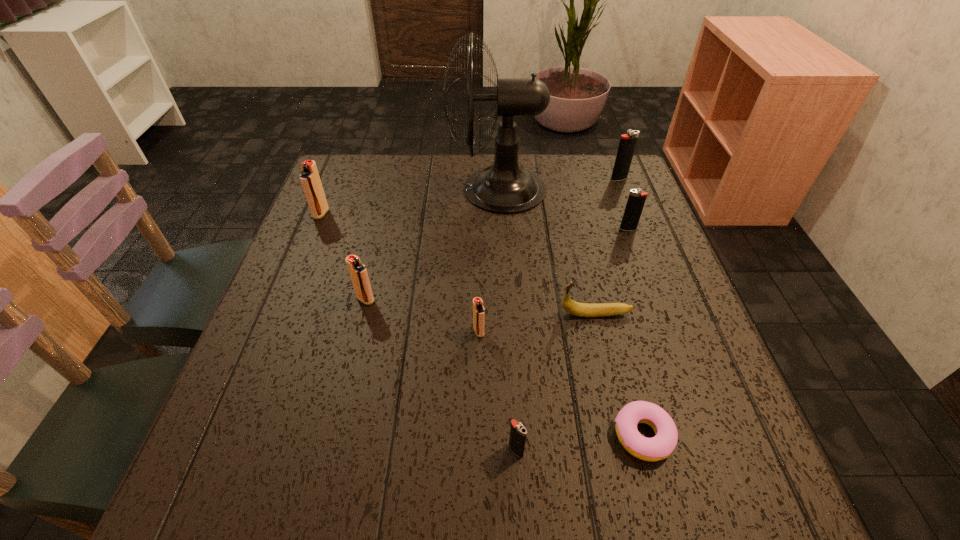
At what (x,y) coordinates should I click in order to perform the action: click on fan. Please return your answer as a coordinate pair (x, y). The image size is (960, 540). Looking at the image, I should click on (505, 188).

Where is `the farthest red igniter`? the farthest red igniter is located at coordinates tap(310, 180).

At what (x,y) coordinates should I click in order to perform the action: click on the leftmost object. Please return your answer as a coordinate pair (x, y). Looking at the image, I should click on (310, 180).

Where is `the farthest igniter`? The image size is (960, 540). the farthest igniter is located at coordinates (627, 144).

Identify the location of the biggest black igniter. (627, 144).

Where is `the sixth nearest object`? the sixth nearest object is located at coordinates (636, 200).

Where is `the second smallest black igniter`? This screenshot has height=540, width=960. the second smallest black igniter is located at coordinates [x=636, y=200].

You are a GUI agent. You are given a task and a screenshot of the screen. Output one action in this format:
    pyautogui.click(x=<x>, y=<y>)
    Task: Click on the second biggest red igniter
    The width and height of the screenshot is (960, 540).
    Given the screenshot: What is the action you would take?
    pyautogui.click(x=358, y=272)

Where is `the second red igniter from left to right`? This screenshot has width=960, height=540. the second red igniter from left to right is located at coordinates (358, 272).

Find the location of a particular element. Image resolution: width=960 pixels, height=540 pixels. yellow banana is located at coordinates [x=572, y=307].